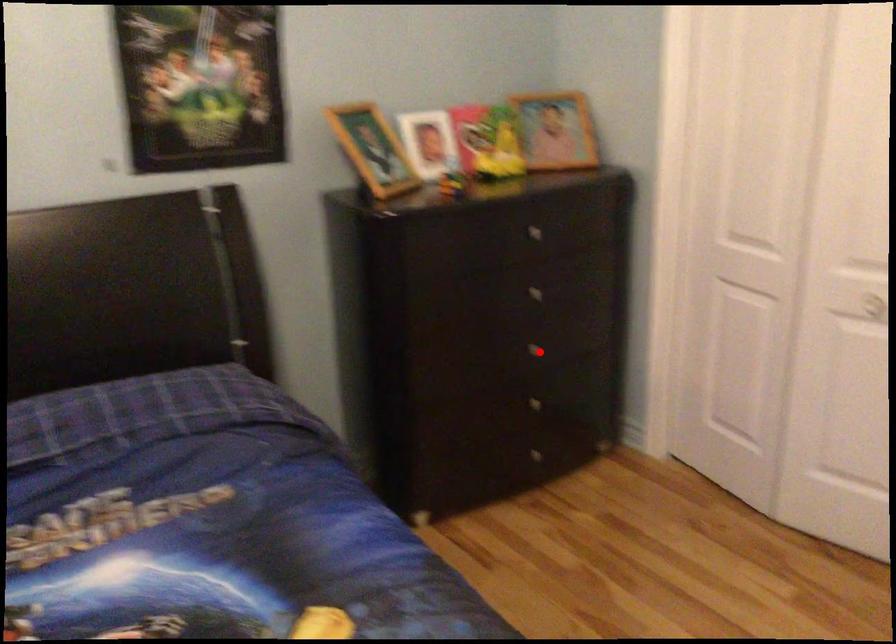
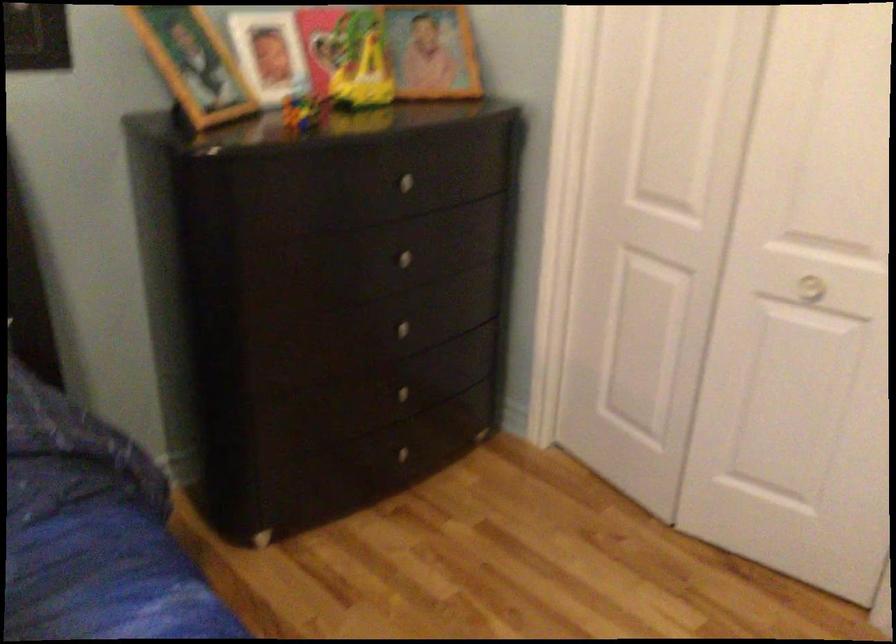
Question: I am providing you with two images of the same scene from different viewpoints. Given a red point in image1, look at the same physical point in image2. Is it:

Choices:
 (A) Closer to the viewpoint
 (B) Farther from the viewpoint

Answer: (A)